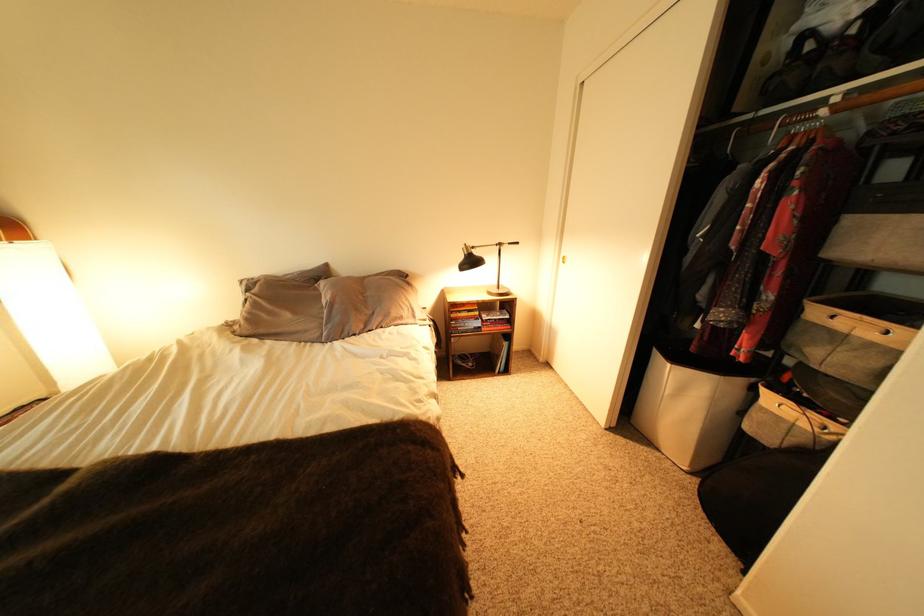
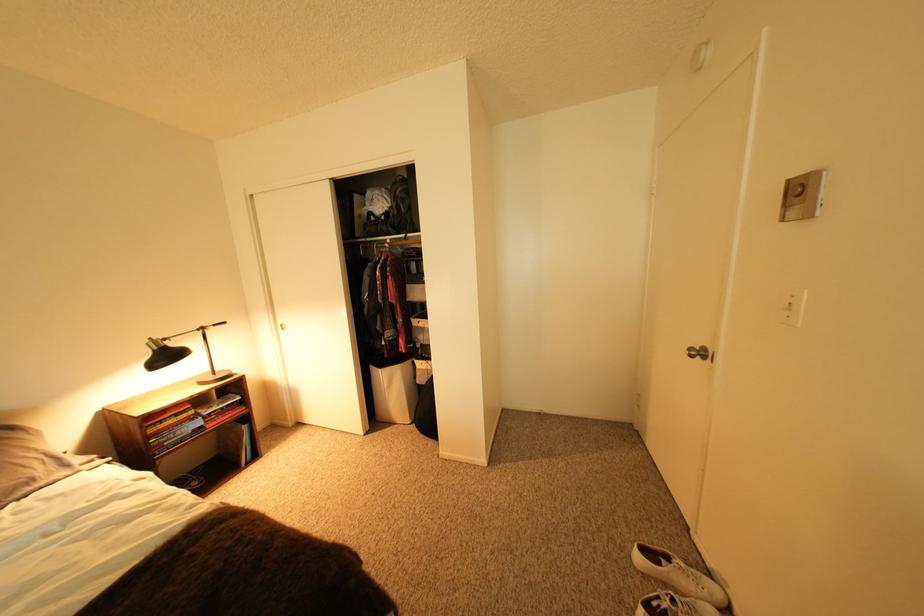
Question: Based on the continuous images, in which direction is the camera rotating? Reply with the corresponding letter.

Choices:
 (A) Left
 (B) Right
 (C) Up
 (D) Down

Answer: (B)